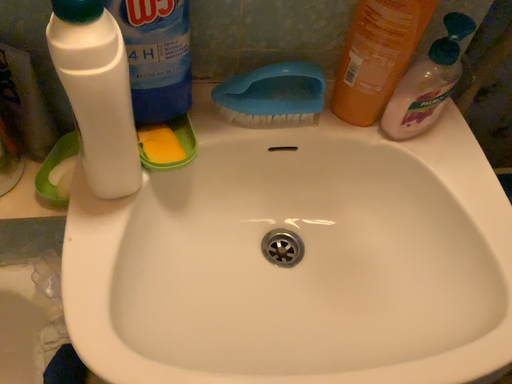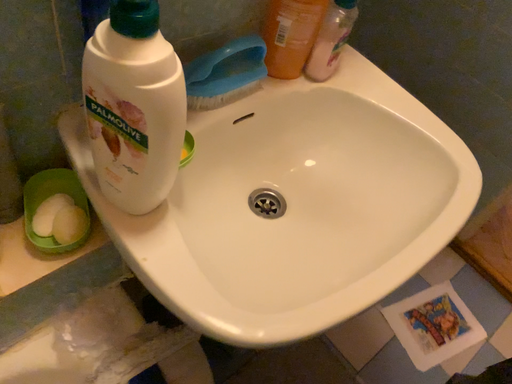
Question: Which way did the camera rotate in the video?

Choices:
 (A) rotated right
 (B) rotated left

Answer: (A)